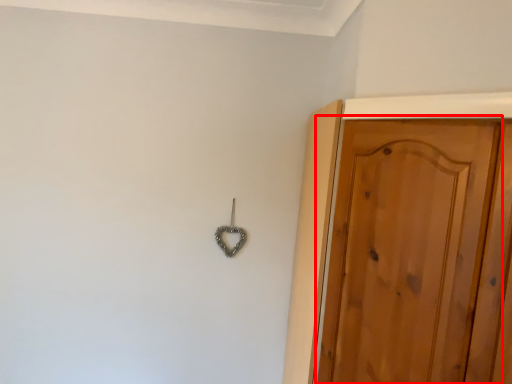
Question: Where is door (annotated by the red box) located in relation to hook in the image?

Choices:
 (A) right
 (B) left

Answer: (A)